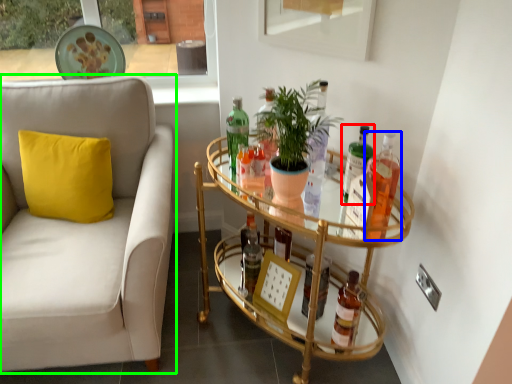
Question: Which object is the farthest from bottle (highlighted by a red box)? Choose among these: bottle (highlighted by a blue box) or studio couch (highlighted by a green box).

Choices:
 (A) bottle
 (B) studio couch

Answer: (B)